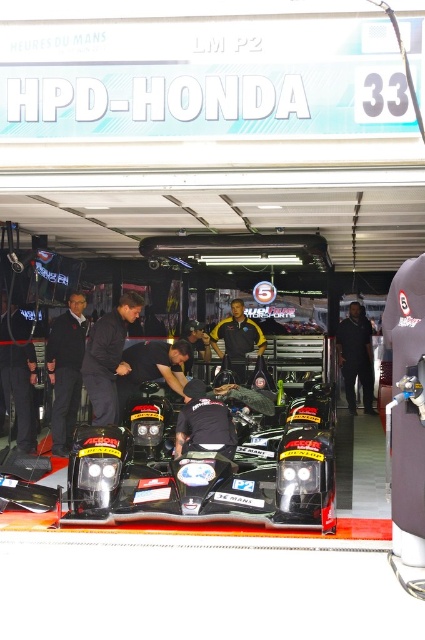
You are a technician working on the black carbon fiber race car at center. You need to place a tool exactly at the point with coordinates (193, 483). Where on the car would this point be located?

The point at coordinates (193, 483) is on the black carbon fiber race car at center, so the tool should be placed there.

You are a photographer at the 24 Heures du Mans garage area. You need to capture a photo of both the black carbon fiber race car at center and the yellow fabric shirt at center. Since your camera has a limited field of view, will you be able to fit both objects in the frame if you position yourself directly in front of the car?

The black carbon fiber race car at center is larger in size than the yellow fabric shirt at center. Since the car is bigger, positioning yourself directly in front of it might block the view of the shirt unless you adjust your angle or move back to include both in the frame.